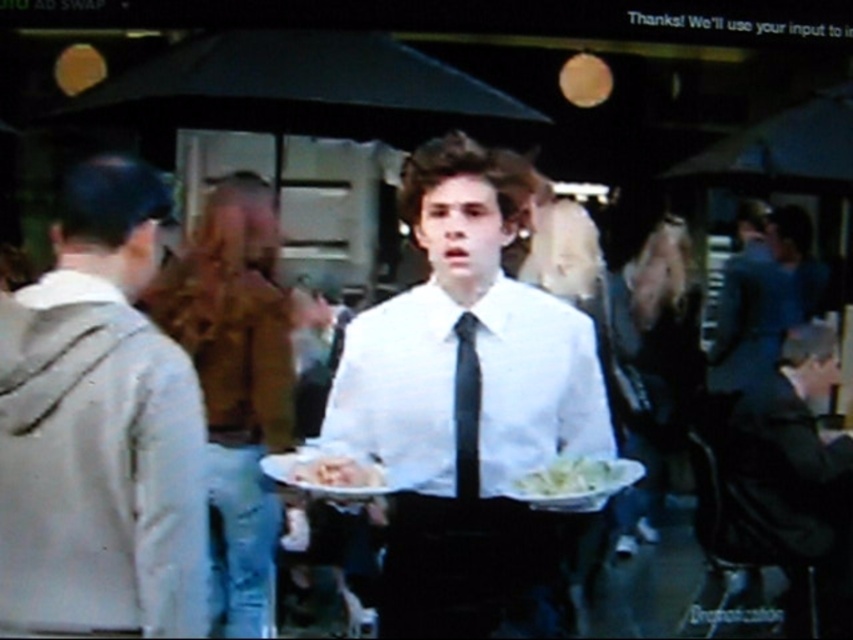
Question: Estimate the real-world distances between objects in this image. Which object is closer to the light gray hoodie at left?

Choices:
 (A) white smooth shirt at center
 (B) dark blue shirt at center

Answer: (A)

Question: Which of the following is the farthest from the observer?

Choices:
 (A) white smooth shirt at center
 (B) black glossy tie at center

Answer: (B)

Question: Is dark blue shirt at center wider than white glossy plate at center?

Choices:
 (A) yes
 (B) no

Answer: (A)

Question: Does light gray hoodie at left have a lesser width compared to dark blue shirt at center?

Choices:
 (A) no
 (B) yes

Answer: (B)

Question: Is white smooth dress shirt at center bigger than dark blue shirt at center?

Choices:
 (A) yes
 (B) no

Answer: (A)

Question: Based on their relative distances, which object is farther from the light gray hoodie at left?

Choices:
 (A) white matte shirt at center
 (B) dark blue shirt at center

Answer: (B)